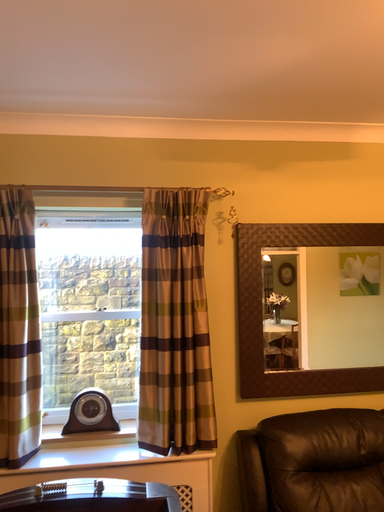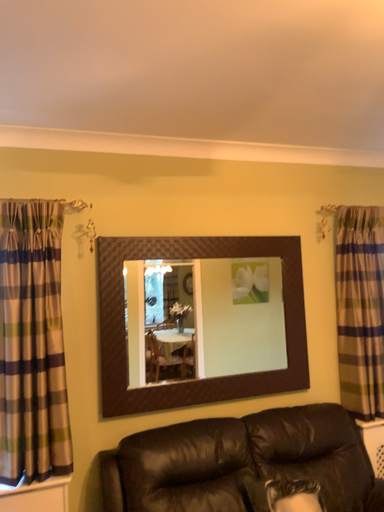
Question: How did the camera likely rotate when shooting the video?

Choices:
 (A) rotated left
 (B) rotated right

Answer: (B)